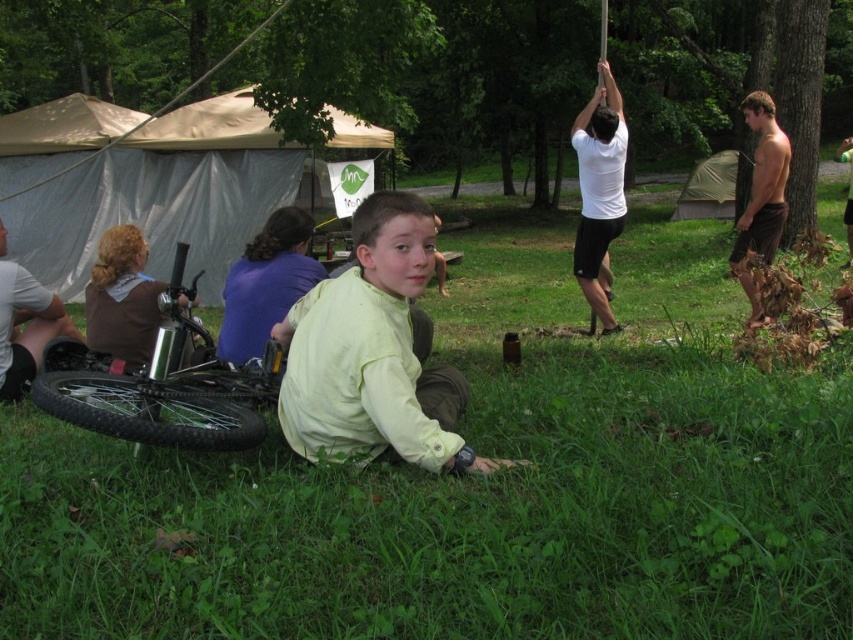
You are standing at the center of the scene and want to pick up the brown textured shorts at right and the brushed metal water bottle at left. Which item is closer to your current position?

Answer: The brown textured shorts at right is above the brushed metal water bottle at left, so the water bottle is lower and likely closer to your position.

You are planning to set up a campsite and need to know the spatial relationship between the beige tarpaulin tent at upper left and the brushed metal water bottle at left. Which object is closer to the camera?

The beige tarpaulin tent at upper left is closer to the camera because it is further to the viewer than the brushed metal water bottle at left.